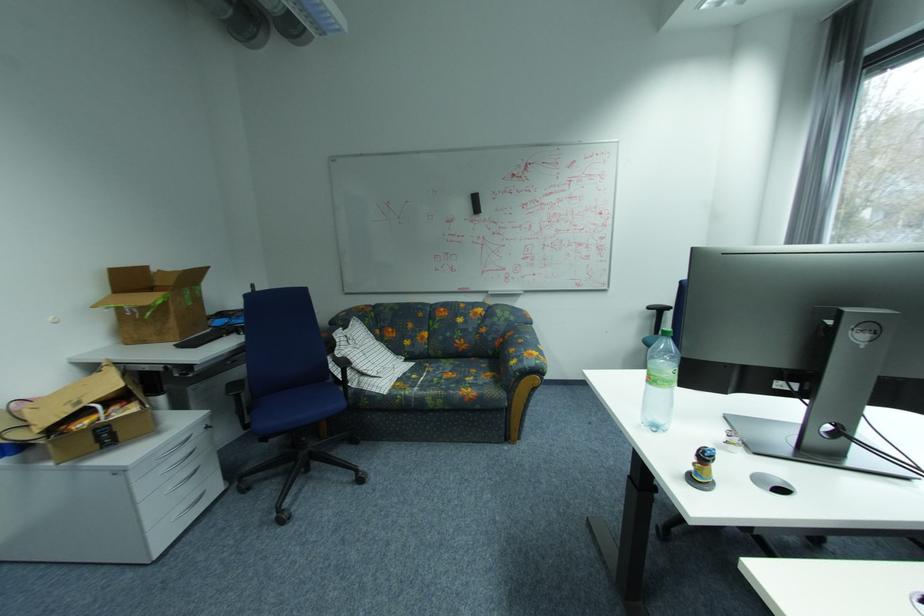
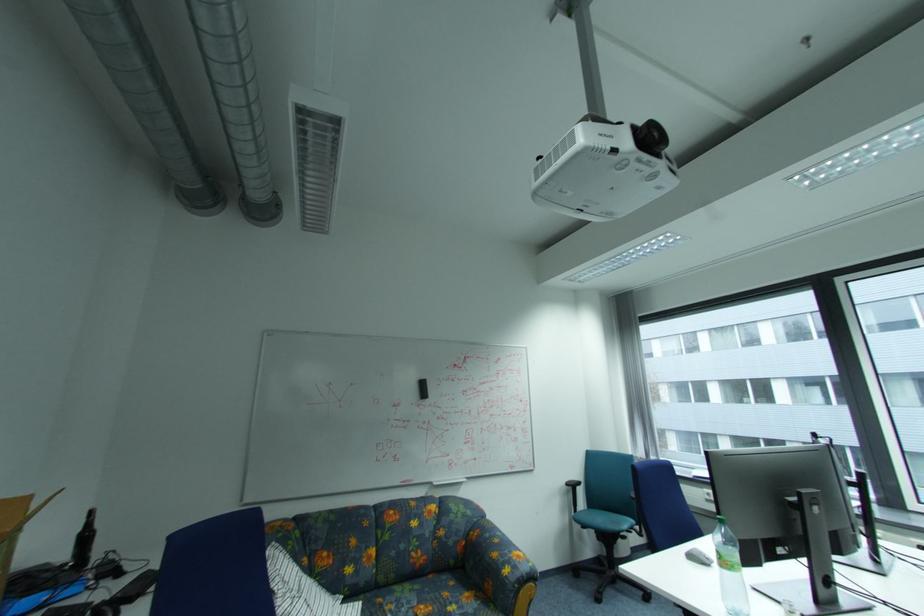
Find the pixel in the second image that matches (466,363) in the first image.

(424, 589)